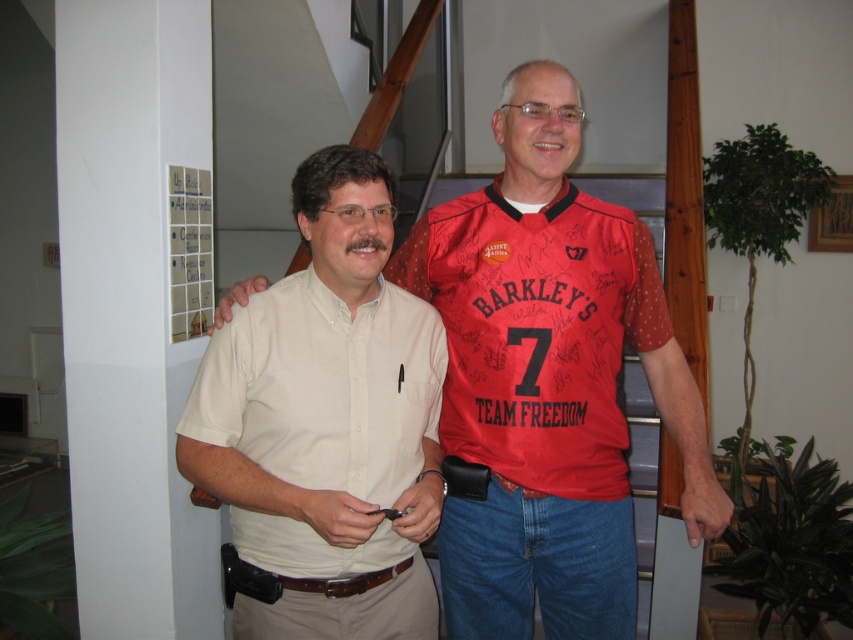
Does red jersey at center appear over blue carpeted stairs at center?

Correct, red jersey at center is located above blue carpeted stairs at center.

Is red jersey at center positioned before blue carpeted stairs at center?

Yes, it is in front of blue carpeted stairs at center.

Which is in front, point (515, 470) or point (645, 525)?

Point (515, 470) is in front.

Locate an element on the screen. This screenshot has height=640, width=853. red jersey at center is located at coordinates (537, 332).

Does beige cotton shirt at center appear over matte white shirt at center?

Actually, beige cotton shirt at center is below matte white shirt at center.

Image resolution: width=853 pixels, height=640 pixels. What do you see at coordinates (323, 387) in the screenshot?
I see `beige cotton shirt at center` at bounding box center [323, 387].

Where is `beige cotton shirt at center`? This screenshot has width=853, height=640. beige cotton shirt at center is located at coordinates [323, 387].

Does point (379, 538) come farther from viewer compared to point (651, 451)?

No, it is in front of (651, 451).

Is point (318, 368) positioned before point (635, 348)?

Yes, it is in front of point (635, 348).

Image resolution: width=853 pixels, height=640 pixels. I want to click on beige cotton shirt at center, so click(x=323, y=387).